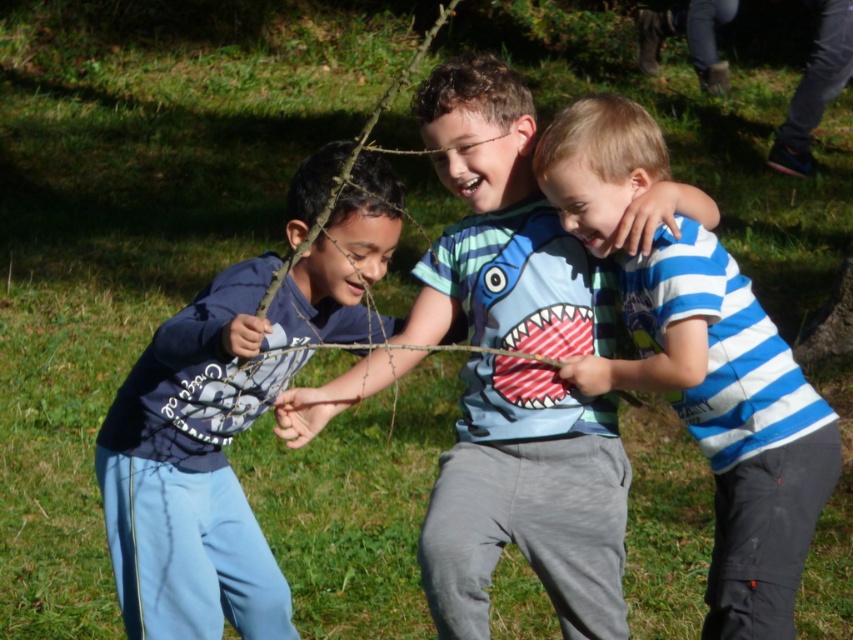
Question: Which point is closer to the camera taking this photo?

Choices:
 (A) (434, 520)
 (B) (728, 362)
 (C) (181, 336)

Answer: (C)

Question: Can you confirm if blue striped shirt at center is positioned below blue cotton shirt at center?

Choices:
 (A) no
 (B) yes

Answer: (A)

Question: Which of the following is the closest to the observer?

Choices:
 (A) (555, 419)
 (B) (254, 346)
 (C) (749, 502)

Answer: (B)

Question: Observing the image, what is the correct spatial positioning of blue striped shirt at center in reference to blue striped shirt at right?

Choices:
 (A) above
 (B) below

Answer: (B)

Question: Based on their relative distances, which object is farther from the blue cotton shirt at center?

Choices:
 (A) blue striped shirt at center
 (B) blue striped shirt at right

Answer: (B)

Question: Where is blue cotton shirt at center located in relation to blue striped shirt at right in the image?

Choices:
 (A) left
 (B) right

Answer: (A)